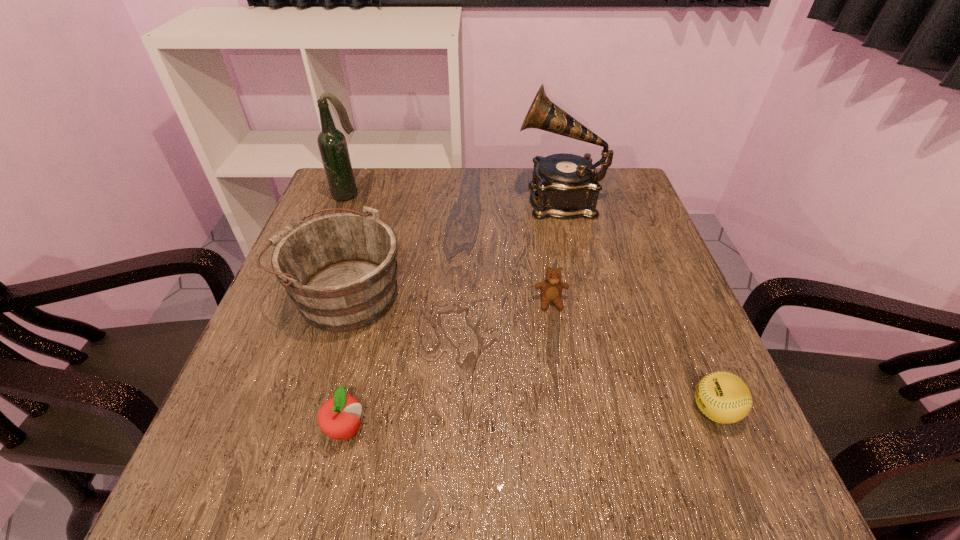
Locate an element on the screen. Image resolution: width=960 pixels, height=540 pixels. free space located on the front of the fourth shortest object is located at coordinates (279, 502).

In order to click on vacant region located 0.080m at the face of the teddy bear in this screenshot , I will do `click(557, 343)`.

Where is `vacant space located on the back of the apple`? The height and width of the screenshot is (540, 960). vacant space located on the back of the apple is located at coordinates point(379,286).

Where is `vacant space located 0.110m on the logo side of the rightmost object`? This screenshot has width=960, height=540. vacant space located 0.110m on the logo side of the rightmost object is located at coordinates (626, 410).

This screenshot has width=960, height=540. In order to click on free space located on the logo side of the rightmost object in this screenshot , I will do `click(637, 410)`.

Where is `free region located 0.150m on the logo side of the rightmost object`? This screenshot has height=540, width=960. free region located 0.150m on the logo side of the rightmost object is located at coordinates (602, 410).

Where is `phonograph record that is positioned at the far edge`? This screenshot has width=960, height=540. phonograph record that is positioned at the far edge is located at coordinates (564, 185).

Locate an element on the screen. Image resolution: width=960 pixels, height=540 pixels. beer bottle located at the far edge is located at coordinates (332, 143).

I want to click on beer bottle located in the left edge section of the desktop, so click(332, 143).

I want to click on wine bucket present at the left edge, so click(340, 269).